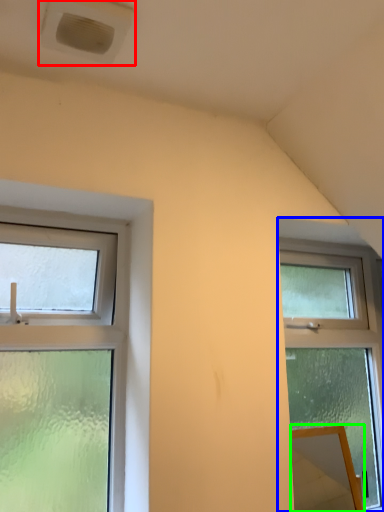
Question: Estimate the real-world distances between objects in this image. Which object is farther from air conditioning (highlighted by a red box), window (highlighted by a blue box) or mirror (highlighted by a green box)?

Choices:
 (A) window
 (B) mirror

Answer: (B)